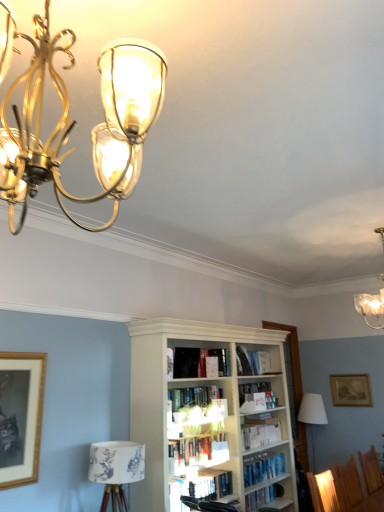
Question: Can you confirm if wooden picture frame at upper right, the 1th picture frame positioned from the right, is thinner than hardcover book at center, placed as the first book when sorted from bottom to top?

Choices:
 (A) no
 (B) yes

Answer: (B)

Question: Is wooden picture frame at upper right, the 1th picture frame positioned from the right, smaller than hardcover book at center, placed as the first book when sorted from bottom to top?

Choices:
 (A) no
 (B) yes

Answer: (B)

Question: Is wooden picture frame at upper right, the 1th picture frame positioned from the right, at the right side of hardcover book at center, placed as the first book when sorted from bottom to top?

Choices:
 (A) yes
 (B) no

Answer: (A)

Question: From a real-world perspective, is wooden picture frame at upper right, which is counted as the 2th picture frame, starting from the front, on top of hardcover book at center, placed as the first book when sorted from bottom to top?

Choices:
 (A) yes
 (B) no

Answer: (A)

Question: Is wooden picture frame at upper right, which is counted as the 2th picture frame, starting from the front, to the left of hardcover book at center, placed as the first book when sorted from bottom to top, from the viewer's perspective?

Choices:
 (A) yes
 (B) no

Answer: (B)

Question: Is wooden picture frame at upper right, the first picture frame when ordered from bottom to top, bigger than hardcover book at center, placed as the first book when sorted from bottom to top?

Choices:
 (A) yes
 (B) no

Answer: (B)

Question: Is hardcover books at center, which is the third book from bottom to top, aimed at hardcover book at center, the 5th book when ordered from bottom to top?

Choices:
 (A) no
 (B) yes

Answer: (A)

Question: From a real-world perspective, is hardcover books at center, arranged as the 3th book when viewed from the top, under hardcover book at center, the 5th book when ordered from bottom to top?

Choices:
 (A) yes
 (B) no

Answer: (A)

Question: From the image's perspective, is hardcover books at center, which is the third book from bottom to top, beneath hardcover book at center, the 5th book when ordered from bottom to top?

Choices:
 (A) no
 (B) yes

Answer: (B)

Question: Is hardcover books at center, which is the third book from bottom to top, to the left of hardcover book at center, the 5th book when ordered from bottom to top, from the viewer's perspective?

Choices:
 (A) yes
 (B) no

Answer: (A)

Question: Considering the relative sizes of hardcover books at center, arranged as the 3th book when viewed from the top, and hardcover book at center, the 5th book when ordered from bottom to top, in the image provided, is hardcover books at center, arranged as the 3th book when viewed from the top, smaller than hardcover book at center, the 5th book when ordered from bottom to top,?

Choices:
 (A) yes
 (B) no

Answer: (A)

Question: Can you confirm if hardcover books at center, which is the third book from bottom to top, is thinner than hardcover book at center, placed as the 1th book when sorted from top to bottom?

Choices:
 (A) no
 (B) yes

Answer: (A)

Question: Could you tell me if hardcover books at center, which is the third book from bottom to top, is turned towards translucent glass chandelier at upper right, acting as the 2th lamp starting from the front?

Choices:
 (A) yes
 (B) no

Answer: (B)